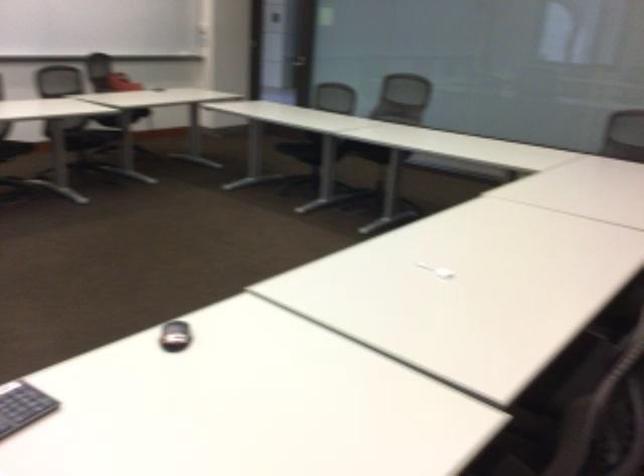
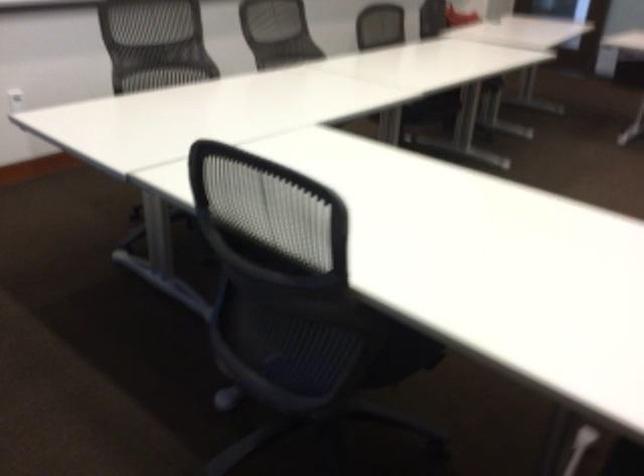
Question: The images are taken continuously from a first-person perspective. In which direction are you moving?

Choices:
 (A) Left
 (B) Right
 (C) Forward
 (D) Backward

Answer: (D)